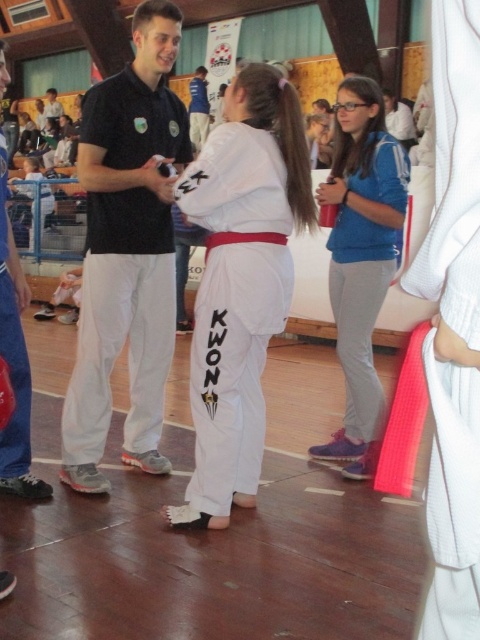
Question: Is black matte shirt at center to the right of blue fleece jacket at center from the viewer's perspective?

Choices:
 (A) yes
 (B) no

Answer: (B)

Question: Can you confirm if white cotton karate gi at center is positioned below black fabric referee at left?

Choices:
 (A) no
 (B) yes

Answer: (A)

Question: Which object appears farthest from the camera in this image?

Choices:
 (A) white cotton karate gi at center
 (B) blue fleece jacket at center
 (C) black fabric referee at left
 (D) black matte shirt at center

Answer: (B)

Question: Is white cotton karate gi at center smaller than blue fleece jacket at center?

Choices:
 (A) yes
 (B) no

Answer: (B)

Question: Among these objects, which one is farthest from the camera?

Choices:
 (A) black fabric referee at left
 (B) blue fleece jacket at center
 (C) black matte shirt at center
 (D) white cotton karate gi at center

Answer: (B)

Question: Estimate the real-world distances between objects in this image. Which object is farther from the white cotton karate gi at center?

Choices:
 (A) blue fleece jacket at center
 (B) black matte shirt at center

Answer: (A)